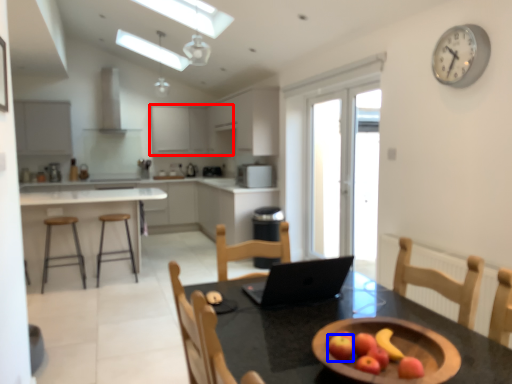
Question: Among these objects, which one is farthest to the camera, cabinetry (highlighted by a red box) or apple (highlighted by a blue box)?

Choices:
 (A) cabinetry
 (B) apple

Answer: (A)